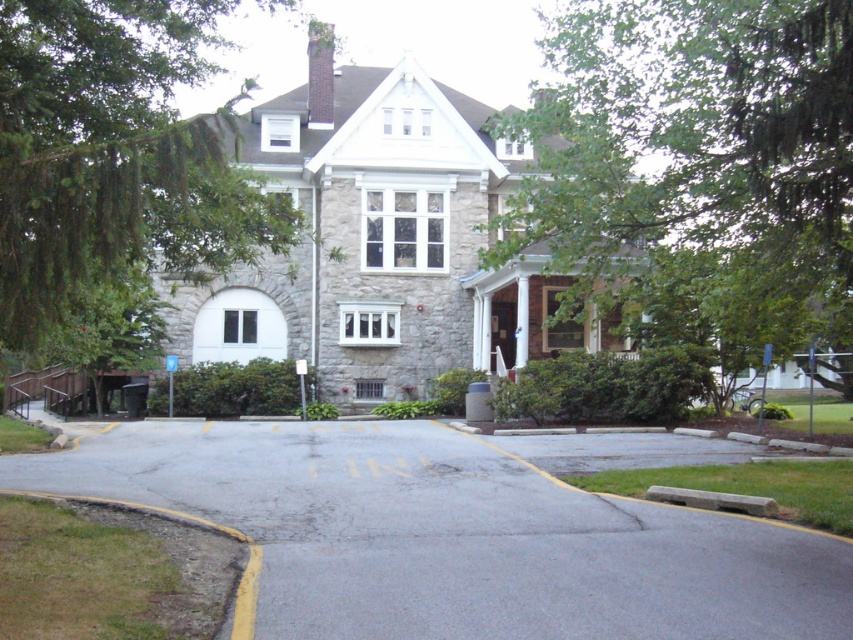
Consider the image. You are a delivery person approaching the gray asphalt driveway at center and the green leafy tree at left. Which object is closer to the entrance of the building?

The gray asphalt driveway at center is closer to the entrance of the building because it is located below the green leafy tree at left, meaning the driveway is positioned in front of the tree relative to the building entrance.

You are standing at the entrance of the building and want to walk to the gray asphalt driveway at center. There is a green leafy tree at left in your path. Which object will you encounter first?

You will encounter the gray asphalt driveway at center first because it is closer to you than the green leafy tree at left.